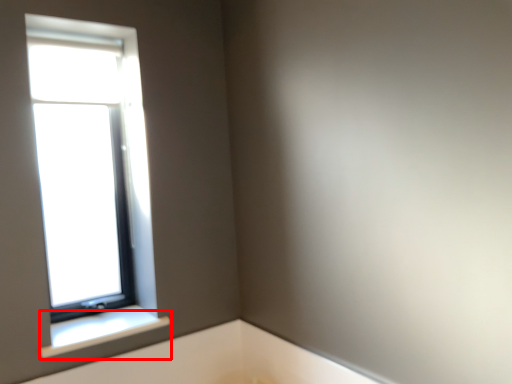
Question: Where is window sill (annotated by the red box) located in relation to window in the image?

Choices:
 (A) right
 (B) left

Answer: (A)